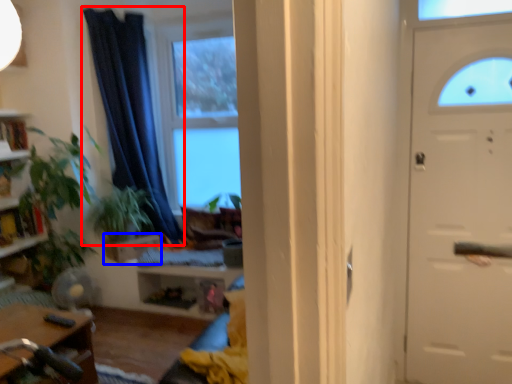
Question: Which object is closer to the camera taking this photo, curtain (highlighted by a red box) or drawer (highlighted by a blue box)?

Choices:
 (A) curtain
 (B) drawer

Answer: (A)